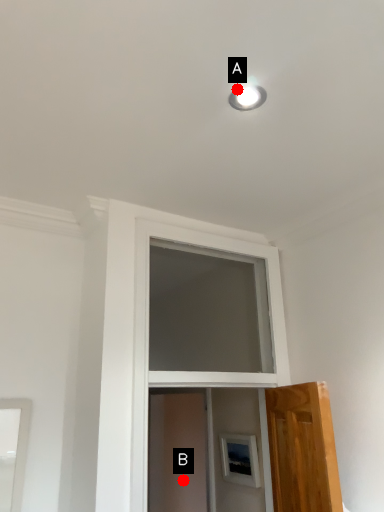
Question: Two points are circled on the image, labeled by A and B beside each circle. Which of the following is the closest to the observer?

Choices:
 (A) A is closer
 (B) B is closer

Answer: (A)